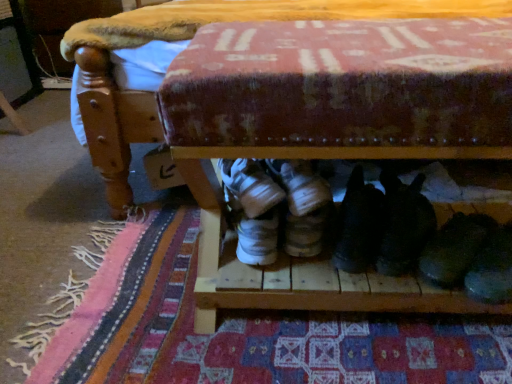
Question: Is black suede shoes at center, which is counted as the 3th footwear, starting from the right, not close to white suede sneakers at center, marked as the fourth footwear in a right-to-left arrangement?

Choices:
 (A) no
 (B) yes

Answer: (A)

Question: Is black suede shoes at center, which is counted as the 3th footwear, starting from the right, positioned with its back to white suede sneakers at center, marked as the fourth footwear in a right-to-left arrangement?

Choices:
 (A) yes
 (B) no

Answer: (B)

Question: Is black suede shoes at center, which is counted as the 3th footwear, starting from the right, oriented towards white suede sneakers at center, the 1th footwear from the left?

Choices:
 (A) yes
 (B) no

Answer: (B)

Question: Is black suede shoes at center, the second footwear when ordered from left to right, thinner than white suede sneakers at center, marked as the fourth footwear in a right-to-left arrangement?

Choices:
 (A) no
 (B) yes

Answer: (B)

Question: From the image's perspective, is black suede shoes at center, which is counted as the 3th footwear, starting from the right, on white suede sneakers at center, marked as the fourth footwear in a right-to-left arrangement?

Choices:
 (A) no
 (B) yes

Answer: (B)

Question: From their relative heights in the image, would you say black suede shoes at lower right, the third footwear in the left-to-right sequence, is taller or shorter than black suede shoes at center, the second footwear when ordered from left to right?

Choices:
 (A) tall
 (B) short

Answer: (B)

Question: Based on their positions, is black suede shoes at lower right, the third footwear in the left-to-right sequence, located to the left or right of black suede shoes at center, which is counted as the 3th footwear, starting from the right?

Choices:
 (A) right
 (B) left

Answer: (A)

Question: From the image's perspective, is black suede shoes at lower right, the third footwear in the left-to-right sequence, above or below black suede shoes at center, which is counted as the 3th footwear, starting from the right?

Choices:
 (A) above
 (B) below

Answer: (A)

Question: From a real-world perspective, is black suede shoes at lower right, the third footwear in the left-to-right sequence, physically located above or below black suede shoes at center, the second footwear when ordered from left to right?

Choices:
 (A) below
 (B) above

Answer: (B)

Question: Relative to black suede shoes at center, which is counted as the 3th footwear, starting from the right, is shiny black shoe at lower right, which is counted as the 1th footwear, starting from the right, in front or behind?

Choices:
 (A) behind
 (B) front

Answer: (B)

Question: Is shiny black shoe at lower right, acting as the 4th footwear starting from the left, to the left or to the right of black suede shoes at center, the second footwear when ordered from left to right, in the image?

Choices:
 (A) left
 (B) right

Answer: (B)

Question: Is shiny black shoe at lower right, which is counted as the 1th footwear, starting from the right, spatially inside black suede shoes at center, the second footwear when ordered from left to right, or outside of it?

Choices:
 (A) outside
 (B) inside

Answer: (A)

Question: Is point (493, 225) closer or farther from the camera than point (353, 167)?

Choices:
 (A) closer
 (B) farther

Answer: (A)

Question: In the image, is shiny black shoe at lower right, acting as the 4th footwear starting from the left, on the left side or the right side of patterned fabric mat at lower center?

Choices:
 (A) left
 (B) right

Answer: (B)

Question: In terms of width, does shiny black shoe at lower right, acting as the 4th footwear starting from the left, look wider or thinner when compared to patterned fabric mat at lower center?

Choices:
 (A) thin
 (B) wide

Answer: (A)